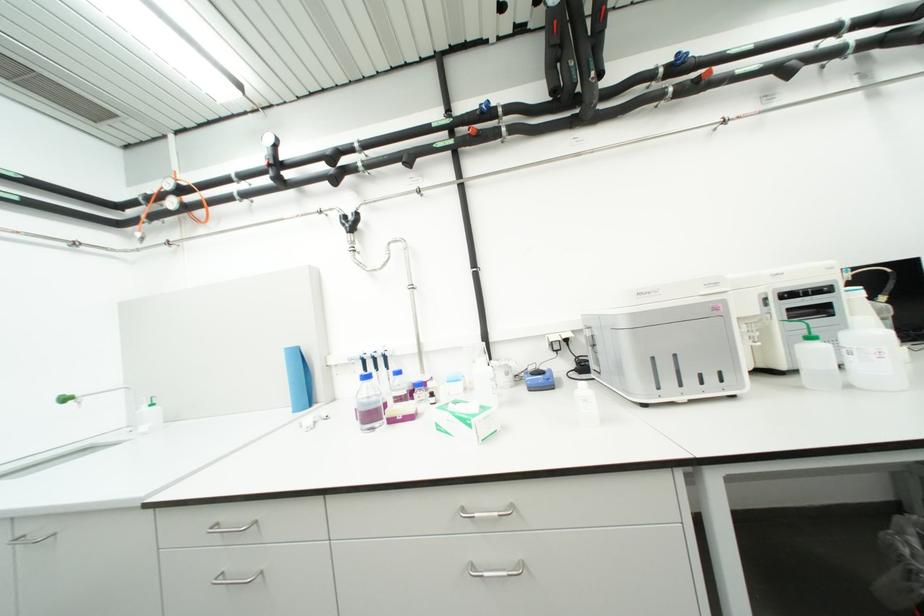
Where would you open the white plastic container? Please return your answer as a coordinate pair (x, y).

(872, 354)